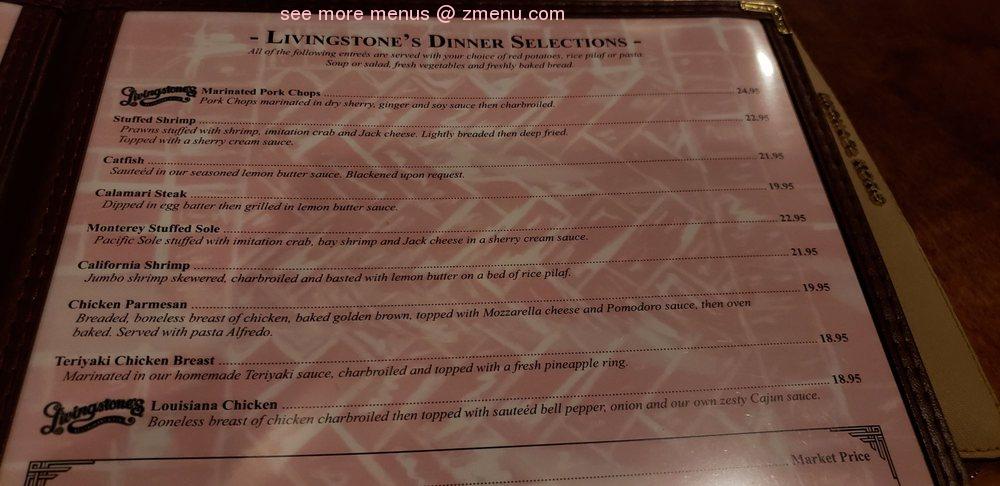
Where is `floor`? floor is located at coordinates (908, 127).